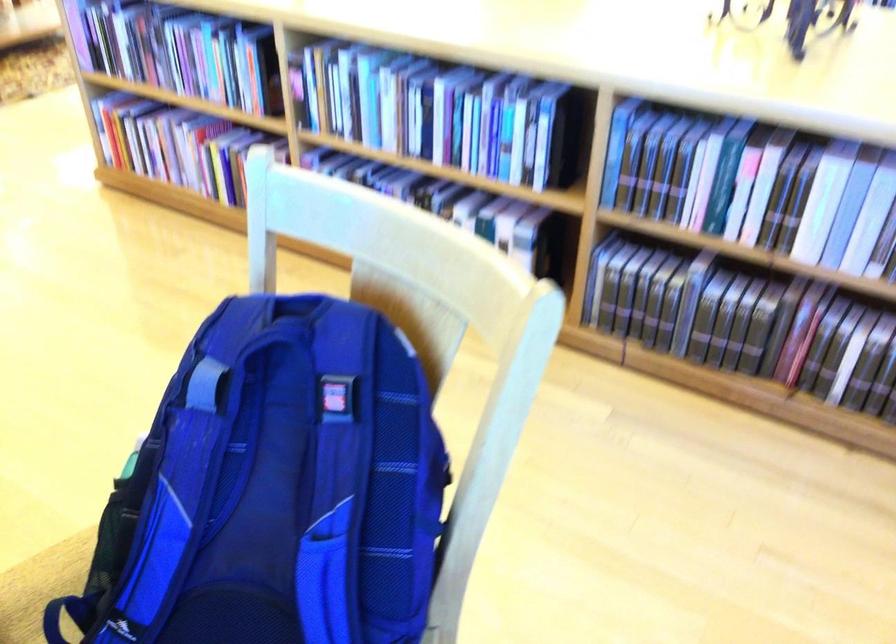
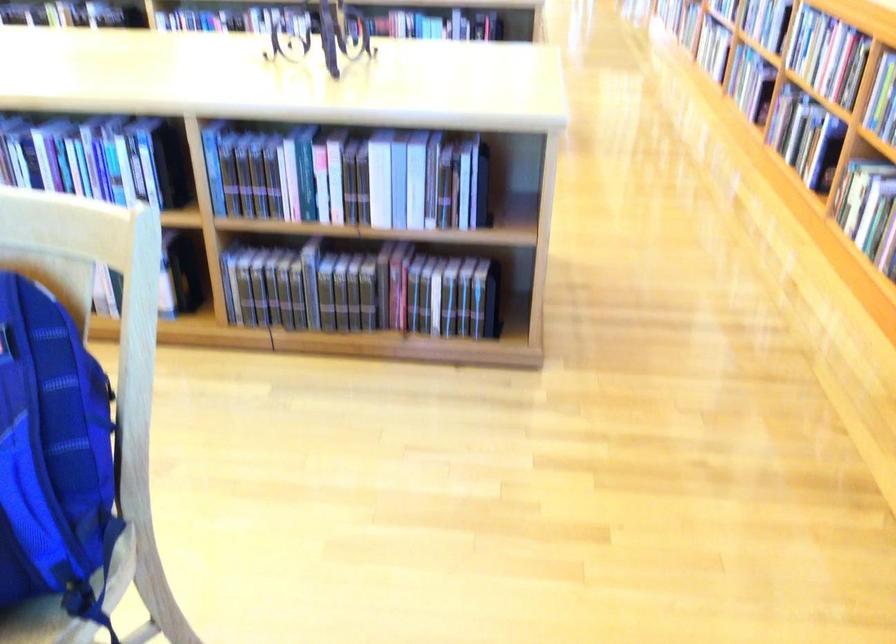
The point at (449, 254) is marked in the first image. Where is the corresponding point in the second image?

(67, 212)